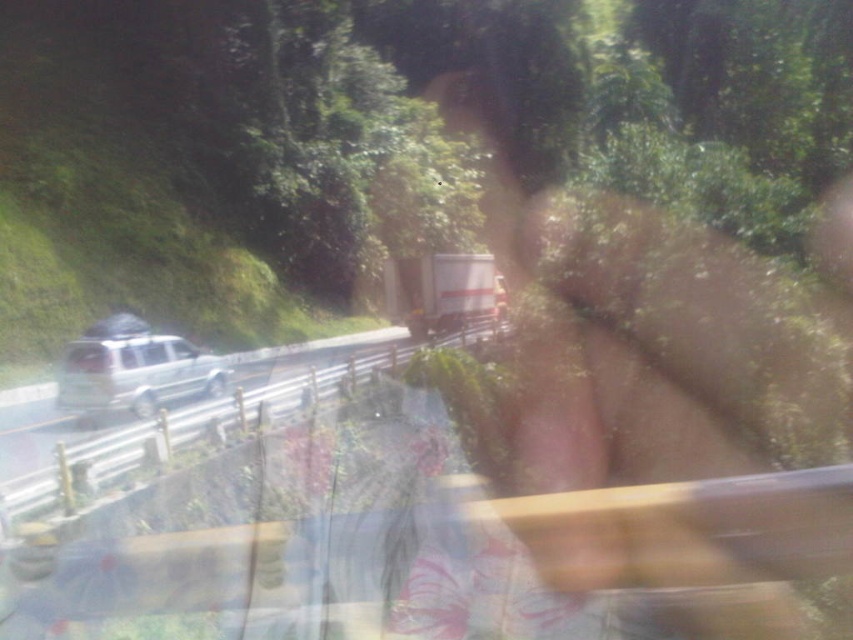
Between silver metallic suv at left and satin silver suv at left, which one appears on the left side from the viewer's perspective?

satin silver suv at left is more to the left.

Can you confirm if silver metallic suv at left is positioned below satin silver suv at left?

Indeed, silver metallic suv at left is positioned under satin silver suv at left.

Is point (16, 516) farther from camera compared to point (76, 380)?

No.

Image resolution: width=853 pixels, height=640 pixels. Identify the location of silver metallic suv at left. (x=206, y=420).